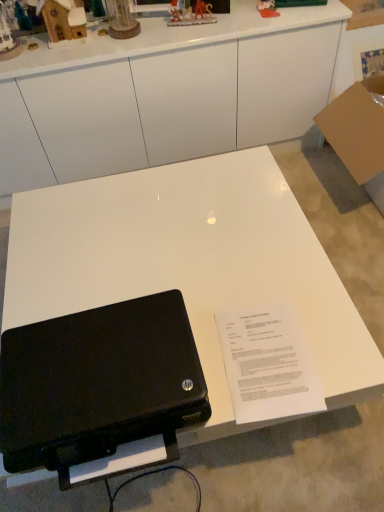
Identify the location of vacant area to the right of white paper at center. This screenshot has height=512, width=384. (335, 344).